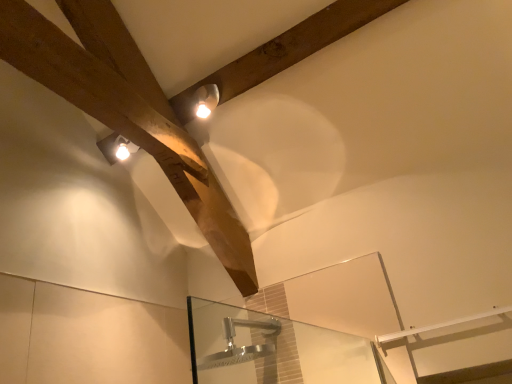
You are a GUI agent. You are given a task and a screenshot of the screen. Output one action in this format:
    pyautogui.click(x=<x>, y=<y>)
    Task: Click on the transparent glass shower door at lower center
    The width and height of the screenshot is (512, 384).
    Given the screenshot: What is the action you would take?
    pyautogui.click(x=273, y=349)

The width and height of the screenshot is (512, 384). What do you see at coordinates (273, 349) in the screenshot? I see `transparent glass shower door at lower center` at bounding box center [273, 349].

From the picture: Measure the distance between transparent glass shower door at lower center and camera.

A distance of 1.45 meters exists between transparent glass shower door at lower center and camera.

This screenshot has width=512, height=384. Find the location of `transparent glass shower door at lower center`. transparent glass shower door at lower center is located at coordinates click(x=273, y=349).